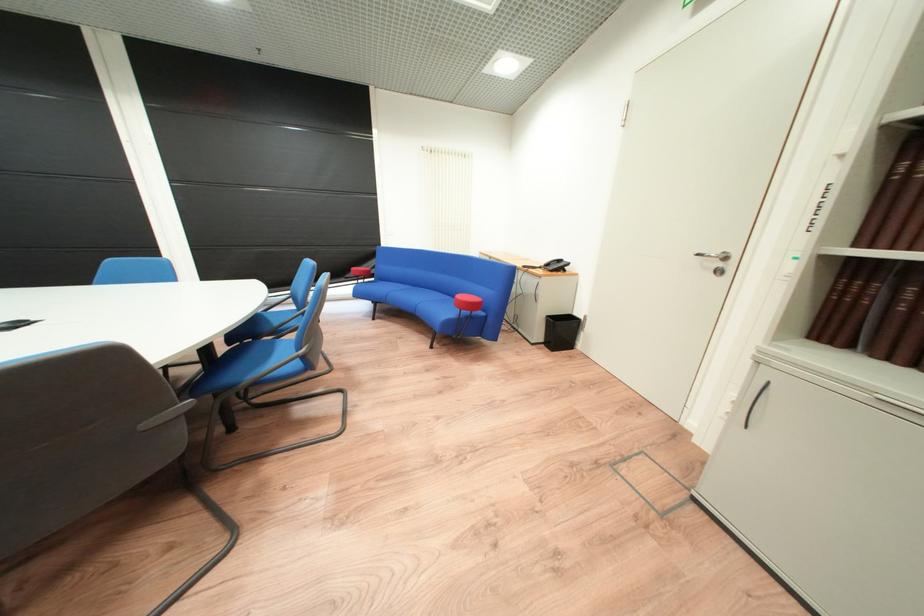
This screenshot has width=924, height=616. I want to click on dark cabinet handle, so click(x=755, y=403).